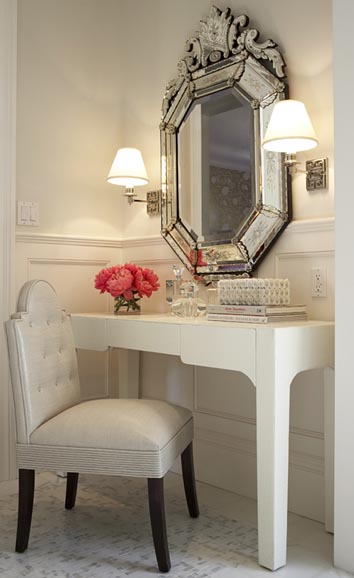
Where is `chair`? chair is located at coordinates (100, 446).